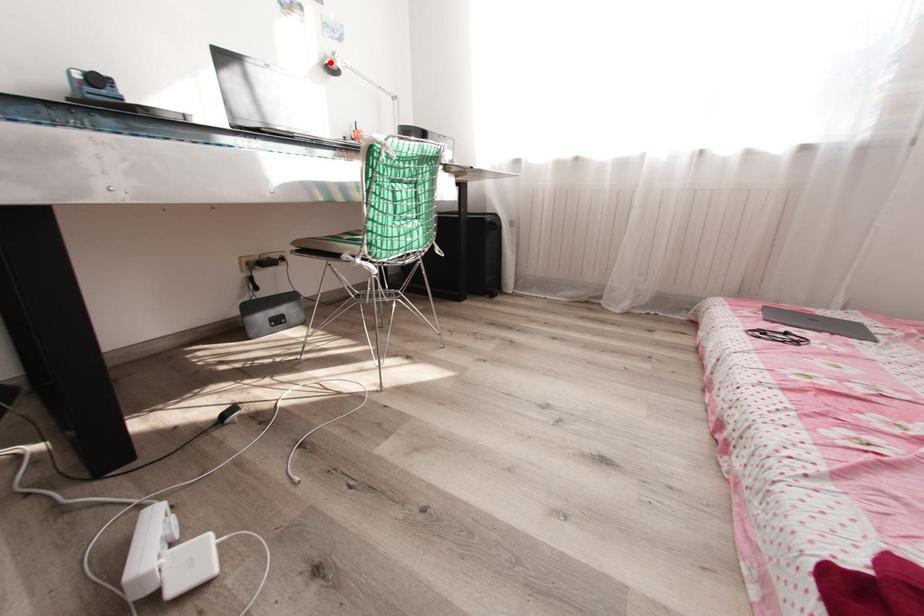
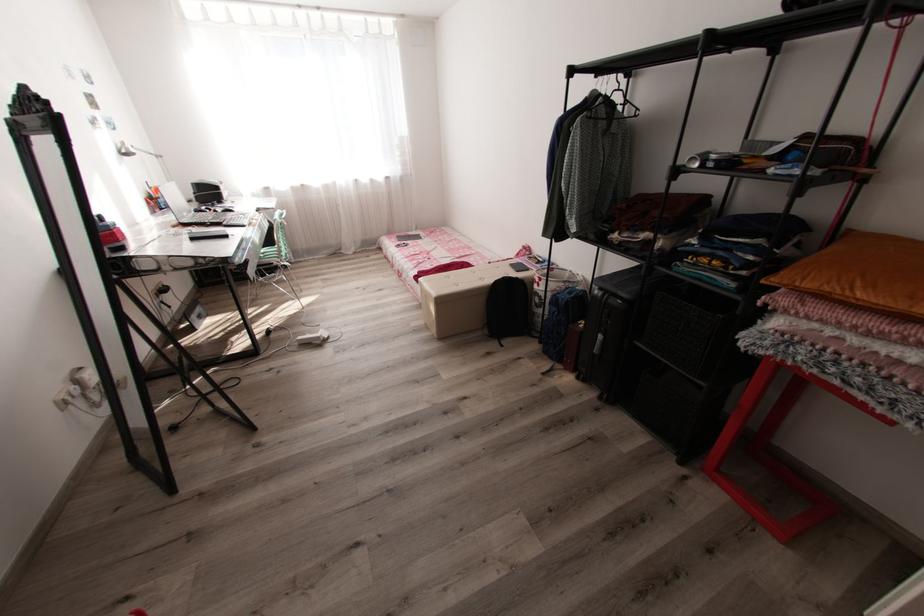
The point at the highlighted location is marked in the first image. Where is the corresponding point in the second image?

(129, 151)